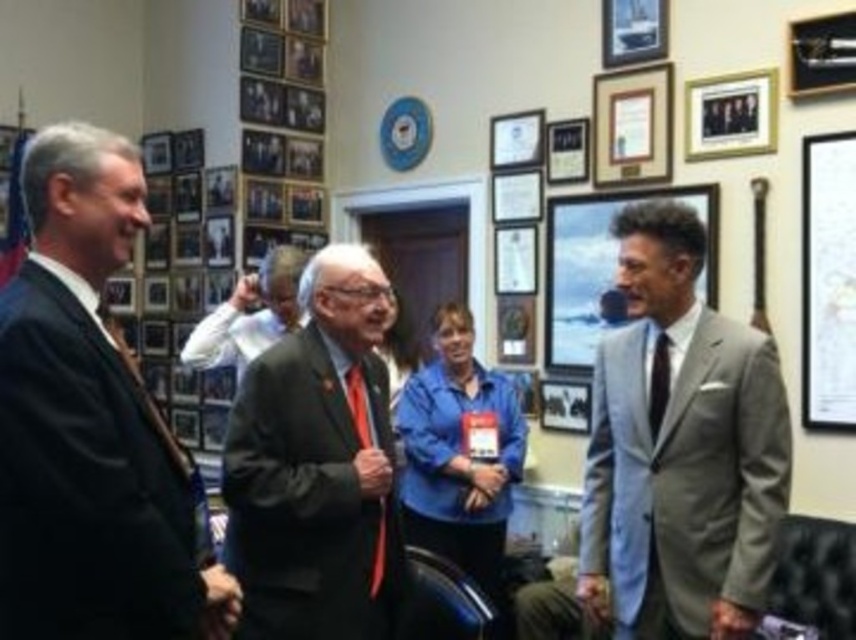
Does matte gray frame at right have a larger size compared to wooden picture frame at upper right?

Correct, matte gray frame at right is larger in size than wooden picture frame at upper right.

Who is higher up, matte gray frame at right or wooden picture frame at upper right?

wooden picture frame at upper right

Does point (574, 204) come farther from viewer compared to point (810, 35)?

Yes, point (574, 204) is behind point (810, 35).

At what (x,y) coordinates should I click in order to perform the action: click on matte gray frame at right. Please return your answer as a coordinate pair (x, y). Looking at the image, I should click on (602, 268).

Can you confirm if matte gold picture frame at upper right is shorter than red satin tie at center?

Correct, matte gold picture frame at upper right is not as tall as red satin tie at center.

Is matte gold picture frame at upper right closer to camera compared to red satin tie at center?

That is False.

Does point (642, 96) come closer to viewer compared to point (375, 540)?

No, (642, 96) is further to viewer.

You are a GUI agent. You are given a task and a screenshot of the screen. Output one action in this format:
    pyautogui.click(x=<x>, y=<y>)
    Task: Click on the matte gold picture frame at upper right
    
    Given the screenshot: What is the action you would take?
    pyautogui.click(x=631, y=125)

Who is positioned more to the right, matte gray frame at right or matte gold picture frame at upper right?

matte gold picture frame at upper right

Is matte gray frame at right in front of matte gold picture frame at upper right?

Yes, it is.

Is point (708, 221) closer to camera compared to point (663, 179)?

Yes, it is.

Where is `matte gray frame at right`? Image resolution: width=856 pixels, height=640 pixels. matte gray frame at right is located at coordinates (602, 268).